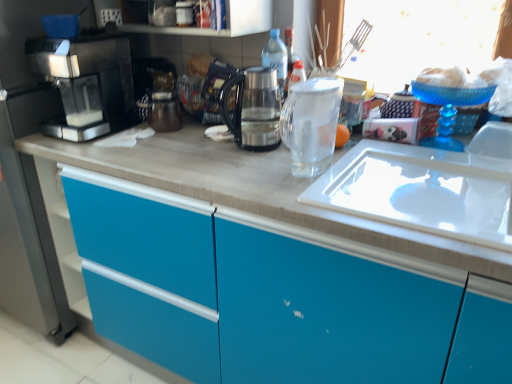
Identify the location of vacant space that is to the left of transparent glass coffee pot at center, placed as the 2th kitchen appliance when sorted from right to left. This screenshot has width=512, height=384. (192, 148).